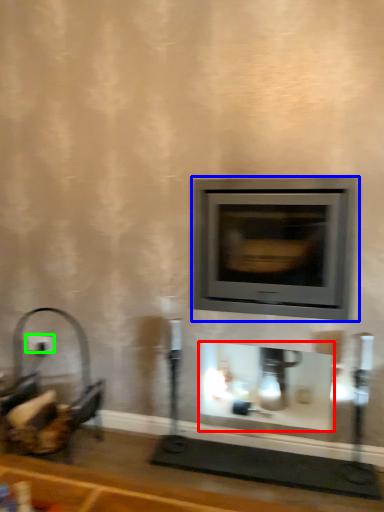
Question: Which object is the farthest from fireplace (highlighted by a red box)? Choose among these: wood burning stove (highlighted by a blue box) or electric outlet (highlighted by a green box).

Choices:
 (A) wood burning stove
 (B) electric outlet

Answer: (B)